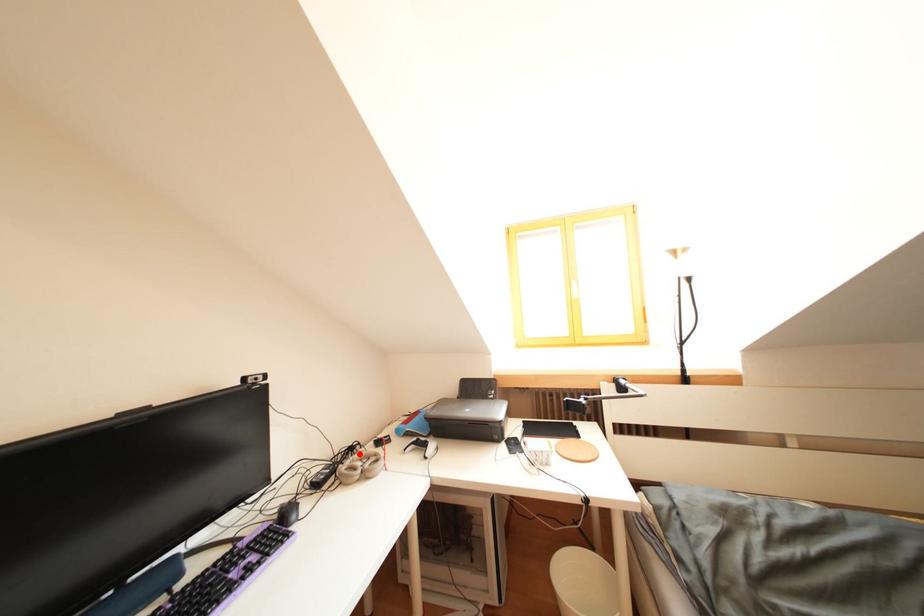
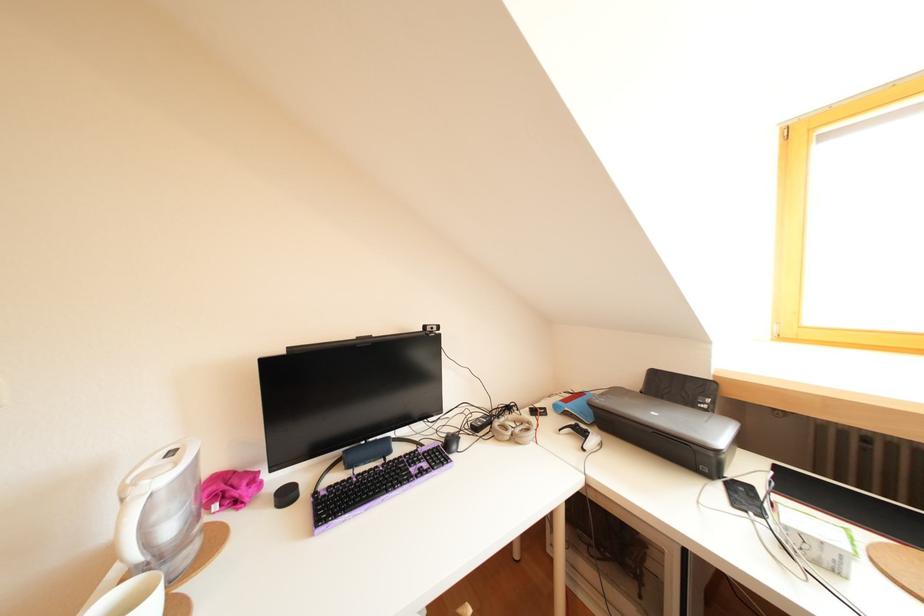
Locate, in the second image, the point that corresponds to the highlighted location in the first image.

(516, 413)